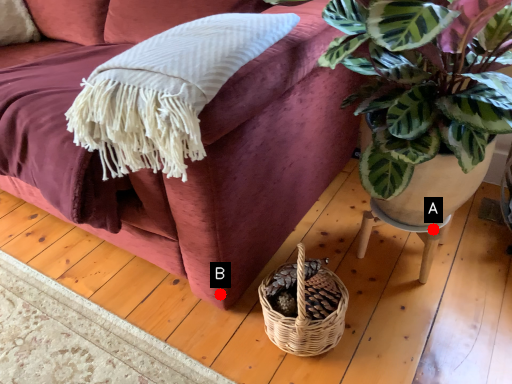
Question: Two points are circled on the image, labeled by A and B beside each circle. Which point is closer to the camera?

Choices:
 (A) A is closer
 (B) B is closer

Answer: (B)